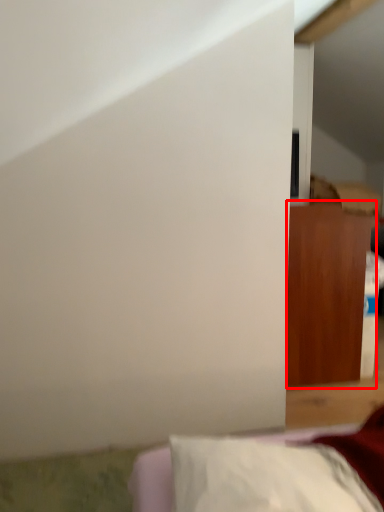
Question: Where is furniture (annotated by the red box) located in relation to furniture in the image?

Choices:
 (A) left
 (B) right

Answer: (B)